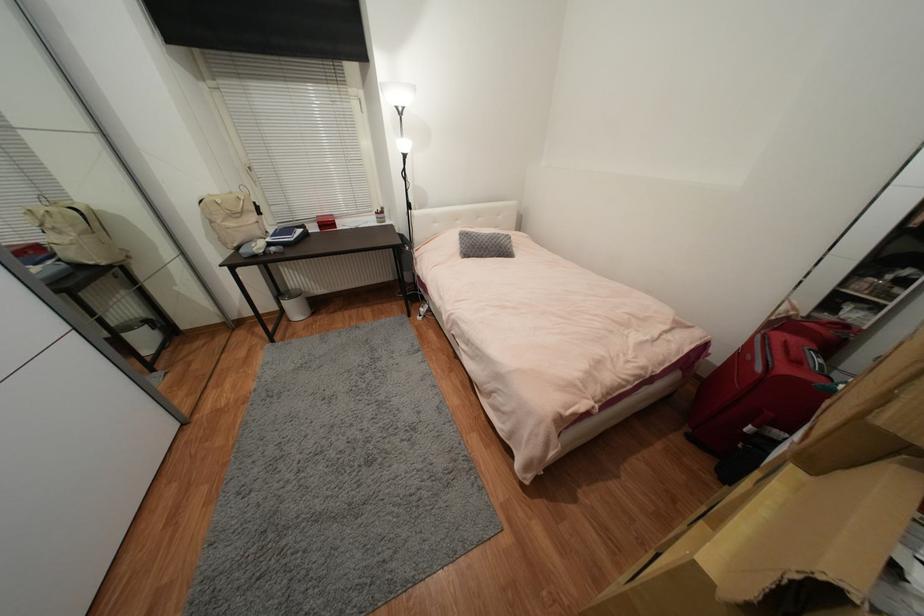
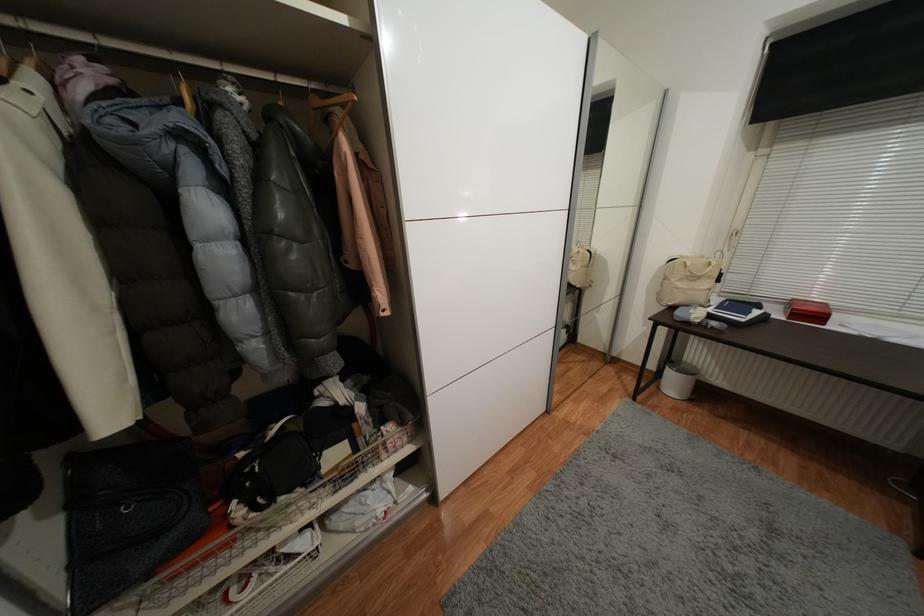
In the second image, find the point that corresponds to [116,269] in the first image.

(582, 291)